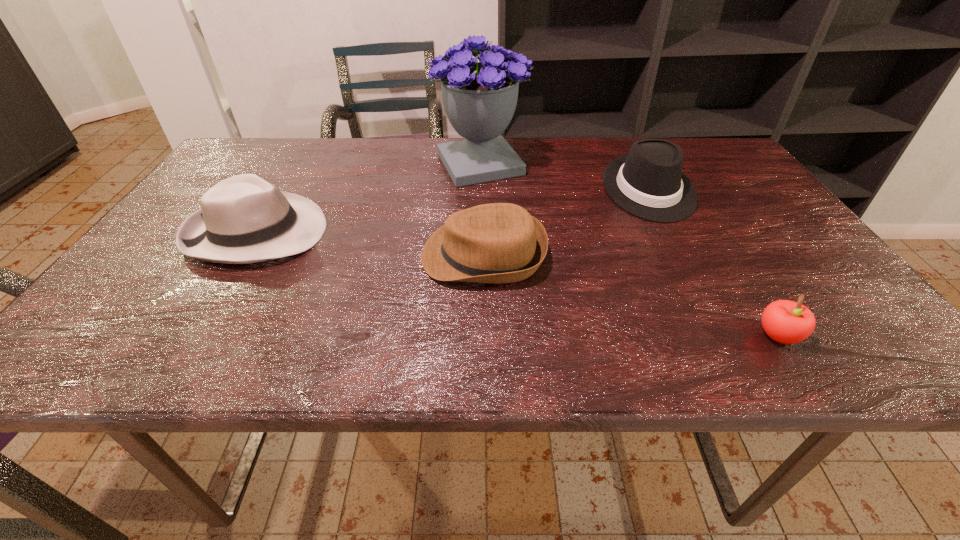
Locate an element on the screen. free space in the image that satisfies the following two spatial constraints: 1. on the front-facing side of the rightmost fedora; 2. on the left side of the nearest object is located at coordinates (724, 335).

This screenshot has height=540, width=960. I want to click on free space that satisfies the following two spatial constraints: 1. on the front-facing side of the leftmost fedora; 2. on the right side of the nearest object, so click(193, 335).

The image size is (960, 540). Find the location of `blank space that satisfies the following two spatial constraints: 1. on the front-facing side of the shortest fedora; 2. on the back side of the nearest object`. blank space that satisfies the following two spatial constraints: 1. on the front-facing side of the shortest fedora; 2. on the back side of the nearest object is located at coordinates (484, 335).

Locate an element on the screen. This screenshot has width=960, height=540. free point that satisfies the following two spatial constraints: 1. on the front-facing side of the rightmost fedora; 2. on the front-facing side of the leftmost object is located at coordinates (670, 232).

The width and height of the screenshot is (960, 540). Find the location of `free space that satisfies the following two spatial constraints: 1. on the front-facing side of the rightmost fedora; 2. on the front-facing side of the second fedora from left to right`. free space that satisfies the following two spatial constraints: 1. on the front-facing side of the rightmost fedora; 2. on the front-facing side of the second fedora from left to right is located at coordinates (683, 255).

Where is `free location that satisfies the following two spatial constraints: 1. on the front-facing side of the second fedora from right to left; 2. on the left side of the apple`? The height and width of the screenshot is (540, 960). free location that satisfies the following two spatial constraints: 1. on the front-facing side of the second fedora from right to left; 2. on the left side of the apple is located at coordinates (484, 335).

At what (x,y) coordinates should I click in order to perform the action: click on free region that satisfies the following two spatial constraints: 1. on the front side of the tallest object; 2. on the front-facing side of the leftmost fedora. Please return your answer as a coordinate pair (x, y). The width and height of the screenshot is (960, 540). Looking at the image, I should click on (480, 232).

Locate an element on the screen. The height and width of the screenshot is (540, 960). vacant space that satisfies the following two spatial constraints: 1. on the front-facing side of the rightmost fedora; 2. on the left side of the nearest object is located at coordinates (724, 335).